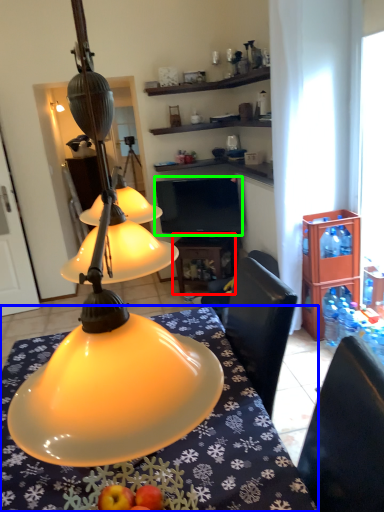
Question: Which is farther away from table (highlighted by a red box)? desk (highlighted by a blue box) or television (highlighted by a green box)?

Choices:
 (A) desk
 (B) television

Answer: (A)